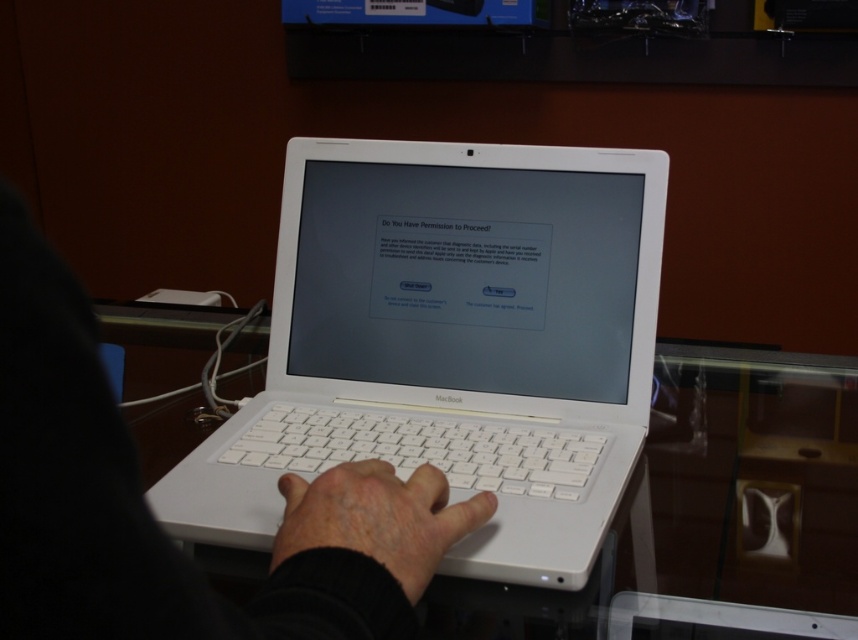
Looking at this image, you are standing in front of a laptop at the center of the image. Where is the point located at coordinates (451,342)?

The point located at coordinates (451,342) corresponds to the white plastic laptop at center.

You are setting up a new laptop and need to place the keyboard on the desk. The desk has limited space. Given the white matte laptop at center and the white plastic keyboard at center, which one takes up more space on the desk?

The white matte laptop at center is bigger than the white plastic keyboard at center, so it takes up more space on the desk.

You are a customer at an electronics store and see the white plastic laptop at center and the white plastic keyboard at center. Which one is taller?

The white plastic laptop at center is taller than the white plastic keyboard at center.